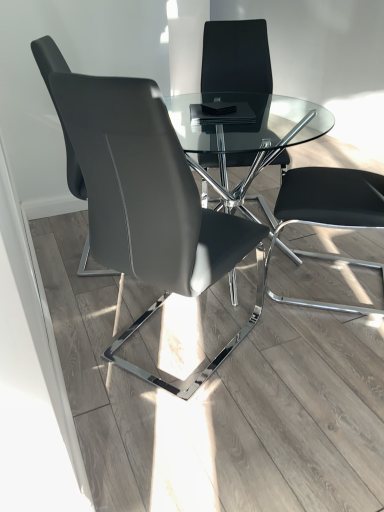
The image size is (384, 512). Find the location of `vacant space in front of black leather chair at right`. vacant space in front of black leather chair at right is located at coordinates (318, 343).